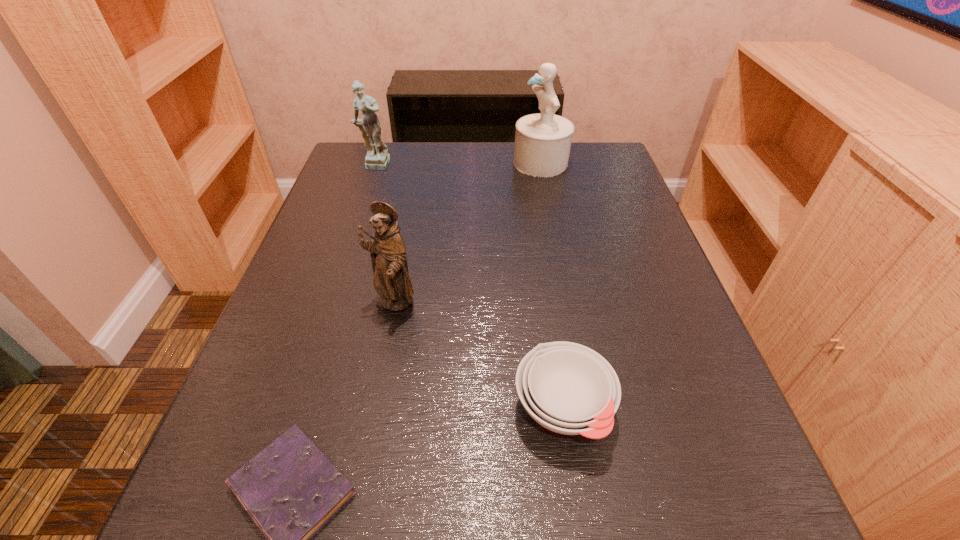
The height and width of the screenshot is (540, 960). I want to click on the rightmost figurine, so click(543, 140).

Locate an element on the screen. Image resolution: width=960 pixels, height=540 pixels. the leftmost figurine is located at coordinates (377, 158).

Find the location of `the nearest figurine`. the nearest figurine is located at coordinates (391, 280).

Where is `the second figurine from left to right`? The width and height of the screenshot is (960, 540). the second figurine from left to right is located at coordinates (391, 280).

You are a GUI agent. You are given a task and a screenshot of the screen. Output one action in this format:
    pyautogui.click(x=<x>, y=<y>)
    Task: Click on the fourth tallest object
    This screenshot has width=960, height=540.
    Given the screenshot: What is the action you would take?
    pyautogui.click(x=568, y=388)

Where is `free space located 0.280m at the beak of the rightmost figurine`? free space located 0.280m at the beak of the rightmost figurine is located at coordinates point(407,163).

Where is `free location located 0.080m at the beak of the rightmost figurine`? This screenshot has height=540, width=960. free location located 0.080m at the beak of the rightmost figurine is located at coordinates (483, 163).

Locate an element on the screen. The width and height of the screenshot is (960, 540). blank area located at the beak of the rightmost figurine is located at coordinates (444, 163).

Find the location of a particular element. The width and height of the screenshot is (960, 540). vacant space situated on the front-facing side of the leftmost figurine is located at coordinates (355, 221).

This screenshot has height=540, width=960. I want to click on free space located on the front-facing side of the second figurine from left to right, so click(x=375, y=400).